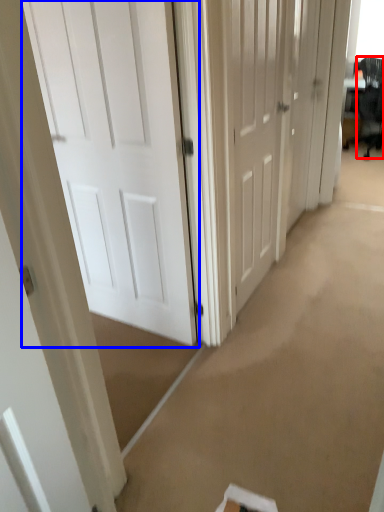
Question: Which object appears closest to the camera in this image, swivel chair (highlighted by a red box) or door (highlighted by a blue box)?

Choices:
 (A) swivel chair
 (B) door

Answer: (B)